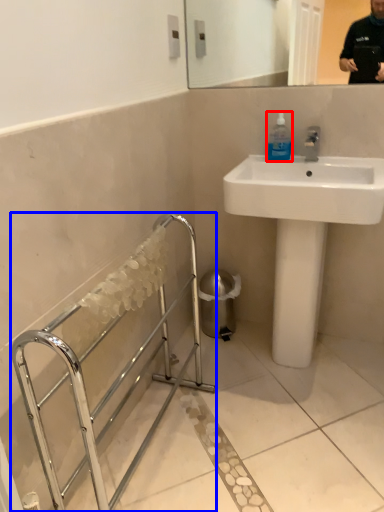
Question: Which point is further to the camera, mouthwash (highlighted by a red box) or balustrade (highlighted by a blue box)?

Choices:
 (A) mouthwash
 (B) balustrade

Answer: (A)